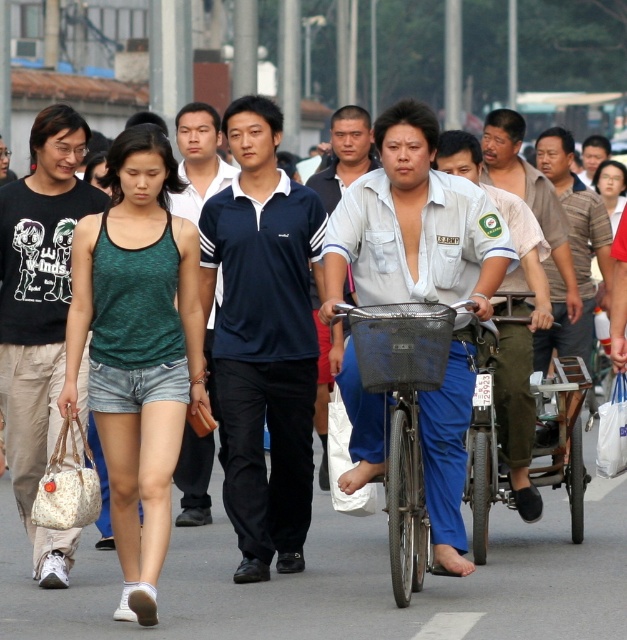
Is point (240, 572) in front of point (542, 362)?

That is True.

Does navy blue jersey at center have a larger size compared to striped cotton shirt at center?

Correct, navy blue jersey at center is larger in size than striped cotton shirt at center.

Identify the location of navy blue jersey at center. [x=263, y=339].

Image resolution: width=627 pixels, height=640 pixels. What do you see at coordinates (263, 339) in the screenshot? I see `navy blue jersey at center` at bounding box center [263, 339].

Between navy blue jersey at center and light brown uniform at center, which one appears on the left side from the viewer's perspective?

Positioned to the left is navy blue jersey at center.

Where is `navy blue jersey at center`? navy blue jersey at center is located at coordinates (263, 339).

From the picture: Does navy blue jersey at center have a greater width compared to black cotton t-shirt at left?

Indeed, navy blue jersey at center has a greater width compared to black cotton t-shirt at left.

Based on the photo, is navy blue jersey at center further to camera compared to black cotton t-shirt at left?

Yes, it is behind black cotton t-shirt at left.

Which is in front, point (265, 564) or point (58, 115)?

Point (265, 564) is in front.

Where is `navy blue jersey at center`? The image size is (627, 640). navy blue jersey at center is located at coordinates 263,339.